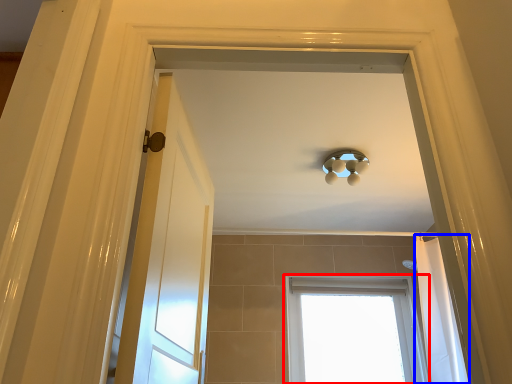
Question: Which of the following is the closest to the observer, window (highlighted by a red box) or shower curtain (highlighted by a blue box)?

Choices:
 (A) window
 (B) shower curtain

Answer: (B)